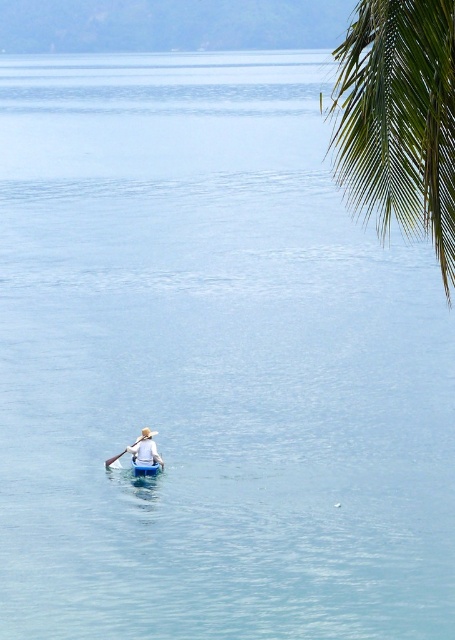
You are a photographer trying to capture a clear shot of both the light blue fabric shirt at center and the blue plastic canoe at center in the image. Given that your camera has a minimum focus distance of 15 centimeters, will you be able to focus on both subjects simultaneously?

The light blue fabric shirt at center and the blue plastic canoe at center are 17.56 centimeters apart from each other. Since the minimum focus distance is 15 centimeters, the photographer can focus on both subjects as the distance between them is greater than the minimum requirement.

Consider the image. You are navigating a kayak and see two points in the water. The first point is at coordinates point (343,109) and the second is at point (151,448). Which point is closer to your current position if you are facing the direction of the distant shoreline?

Point (343,109) is in front of point (151,448), so if you are facing the direction of the distant shoreline, the point (343,109) would be closer to your current position.

You are a photographer trying to capture the green leafy palm tree at upper right and the light blue fabric shirt at center in a single shot. Can you adjust your camera angle so that the palm tree appears above the shirt in the photo?

The green leafy palm tree at upper right is already positioned over the light blue fabric shirt at center, so adjusting the camera angle to have the palm tree appear above the shirt is possible as it is already in that position.